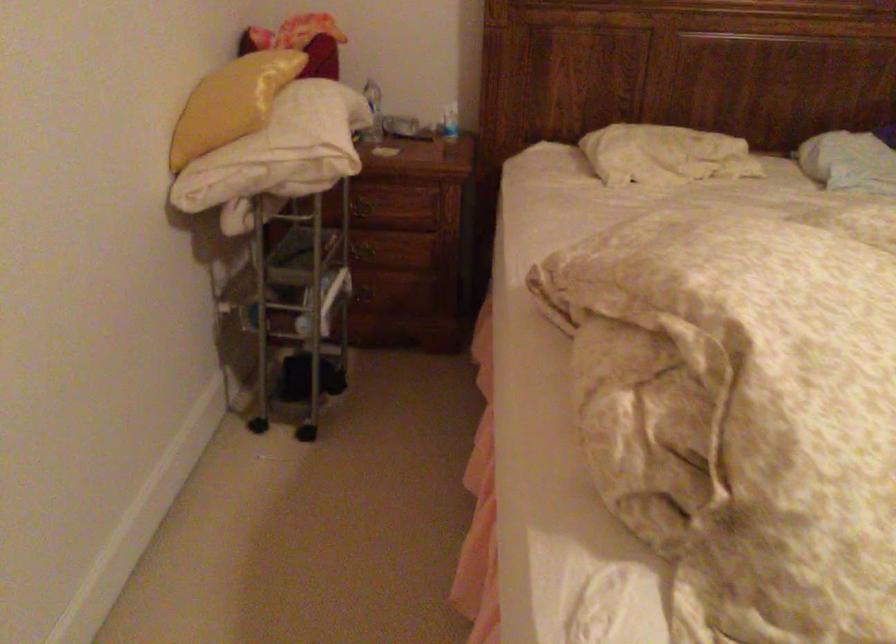
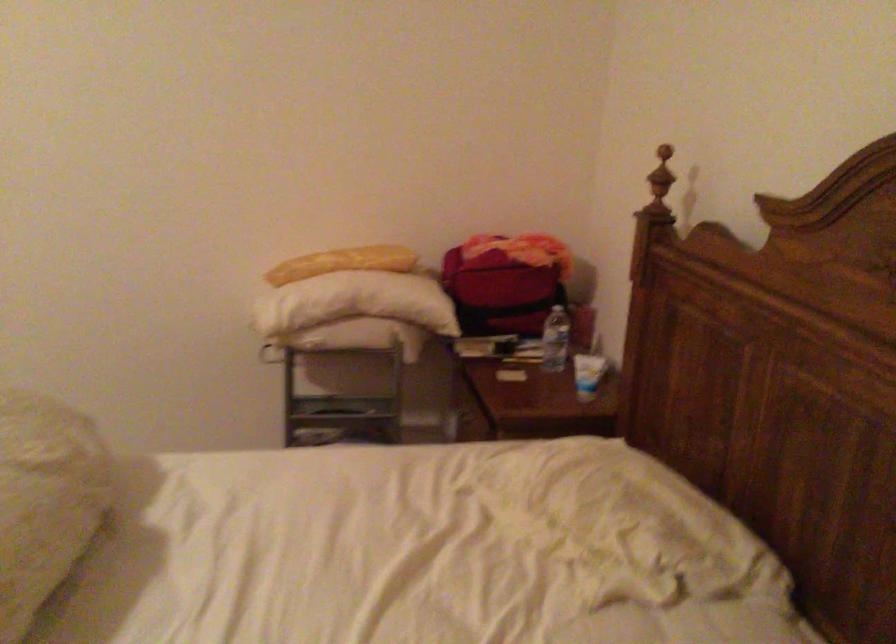
Find the pixel in the second image that matches (x=270, y=88) in the first image.

(342, 263)